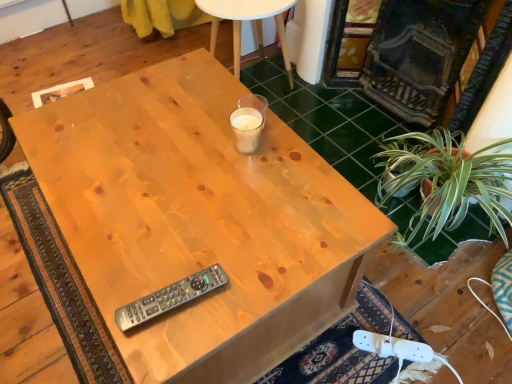
At what (x,y) coordinates should I click in order to perform the action: click on free space to the back side of white paper cup at center, positioned as the first coffee cup in top-to-bottom order. Please return your answer as a coordinate pair (x, y). The height and width of the screenshot is (384, 512). Looking at the image, I should click on (222, 87).